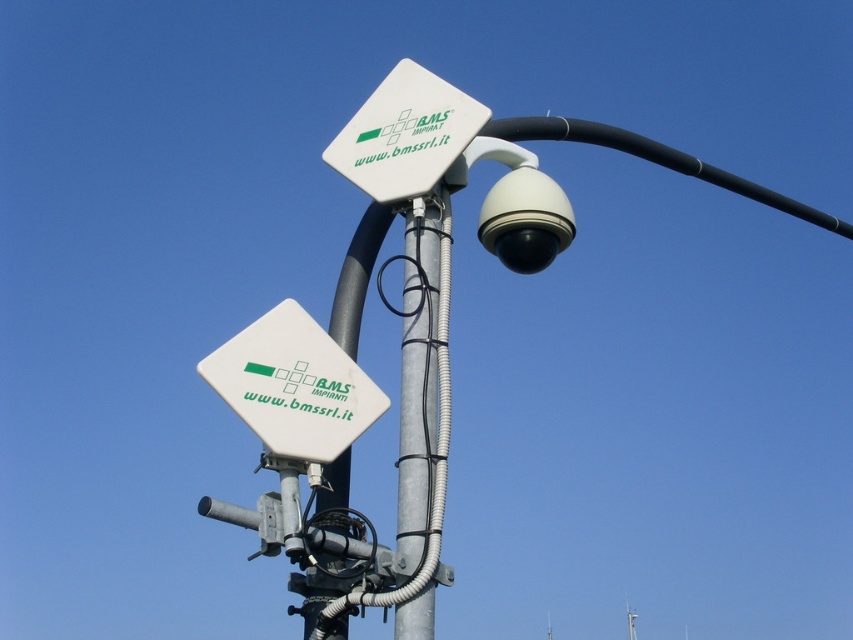
You are a technician trying to locate the white matte sign at upper left on the pole. According to the coordinates provided, where exactly should you look on the pole?

The white matte sign at upper left is located at point coordinates of (293, 385) on the pole.